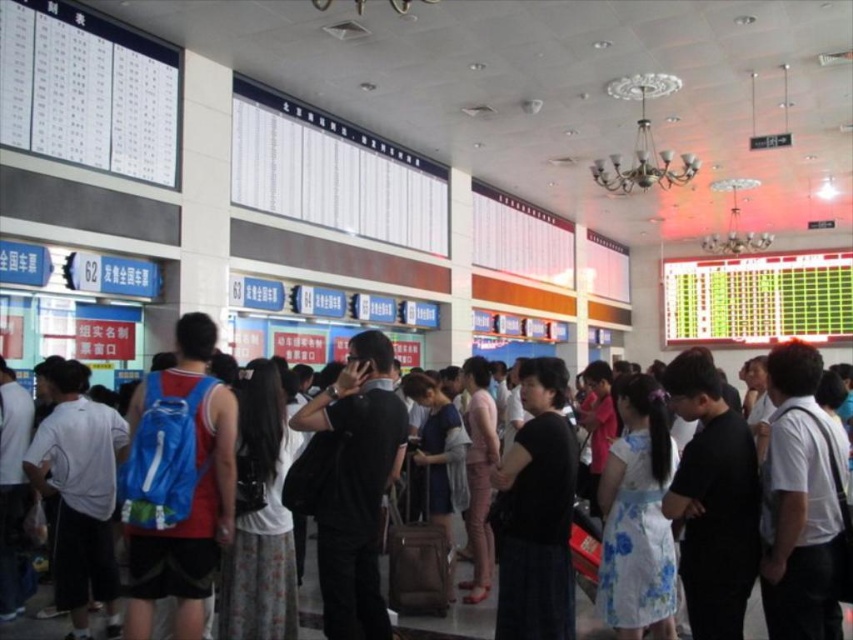
You are a person standing at the center of a busy ticketing area in a train station. You see a black matte dress at center and a light brown fabric backpack at center. If you want to pick up both items, which one would you need to reach for first considering their positions?

Both the black matte dress at center and the light brown fabric backpack at center are located at the center, but the black matte dress is 2.30 meters away from the backpack. Since you are standing at the center, you can reach either item first depending on your reach, but according to the description, the dress is farther from the backpack, so their exact positions aren

You are a traveler who just arrived at the ticketing area and see a light brown fabric backpack at center and a brown fabric suitcase at center. Which item is nearer to you?

The light brown fabric backpack at center is closer to the viewer than the brown fabric suitcase at center, so the backpack is nearer to you.

You are a traveler who just arrived at the station and need to check the ticket information on the screens. You have a blue fabric backpack at left and a brown fabric suitcase at center. Which item is more likely to block your view of the screens?

The brown fabric suitcase at center is larger in size, so it might block your view more than the blue fabric backpack at left.